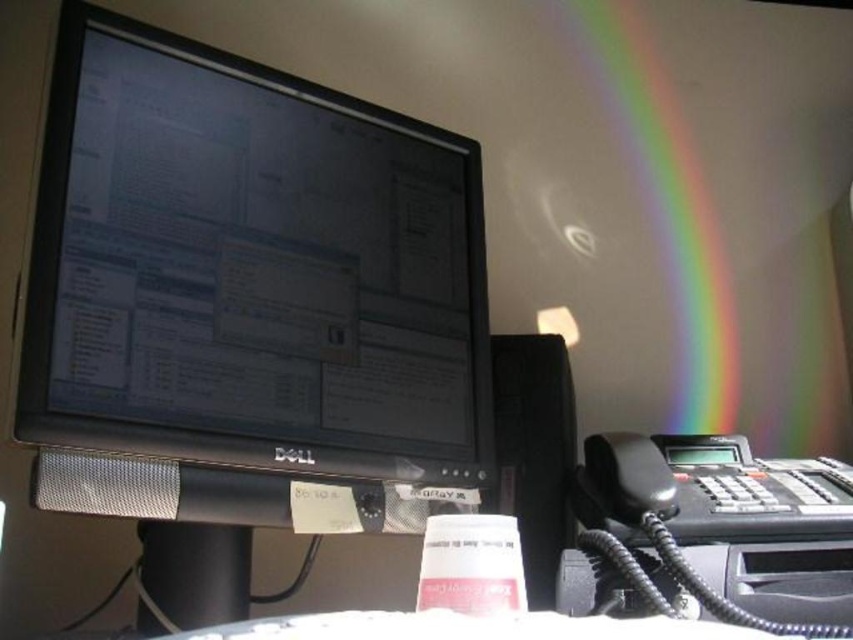
You are organizing the desk and need to place a new item between the black matte monitor at center and the rainbow translucent at upper right. Considering their heights, which object should you place the item closer to?

The black matte monitor at center is shorter than the rainbow translucent at upper right, so you should place the item closer to the rainbow translucent at upper right to ensure stability and balance based on their height difference.

You are organizing the desk items and need to place a new item between the black matte monitor at center and the rainbow translucent at upper right. Based on their positions, which object should the new item be closer to?

The new item should be closer to the rainbow translucent at upper right because the black matte monitor at center is closer to the viewer, meaning the rainbow translucent at upper right is farther away. To place the new item between them, it needs to be positioned closer to the farther object.

You are standing in front of the workspace setup. There are two points marked in the image. The first point is at coordinates point (x=413, y=348) and the second point is at point (x=717, y=388). From your perspective, which point is closer to you?

Point (x=413, y=348) is in front of point (x=717, y=388), so it is closer to you.